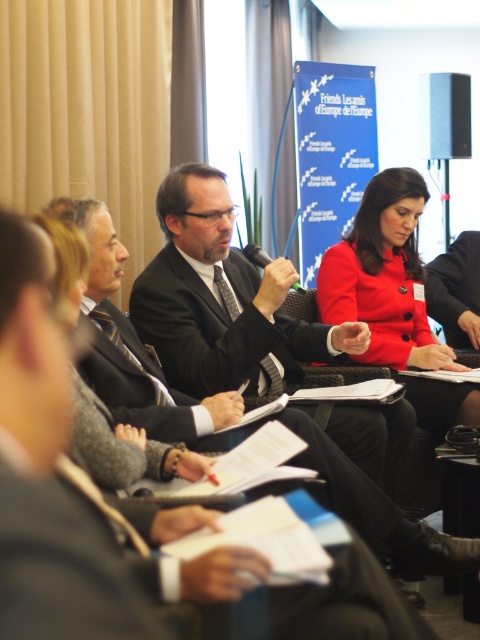
You are attending a conference and notice two individuals at the center of the image wearing the dark gray suit at center and the matte black suit at center. Which one has a shorter height?

The dark gray suit at center is shorter than matte black suit at center, so the person wearing the dark gray suit at center is shorter.

From the picture: In the formal meeting scene, there is a point at coordinates (217, 326). Which object from the scene is located at this point?

The point at coordinates (217, 326) corresponds to the dark gray suit at center.

Consider the image. In the formal meeting scene, there are two individuals at the center wearing dark gray suit at center and matte black suit at center. Which one is positioned to the left?

The dark gray suit at center is to the left of the matte black suit at center.